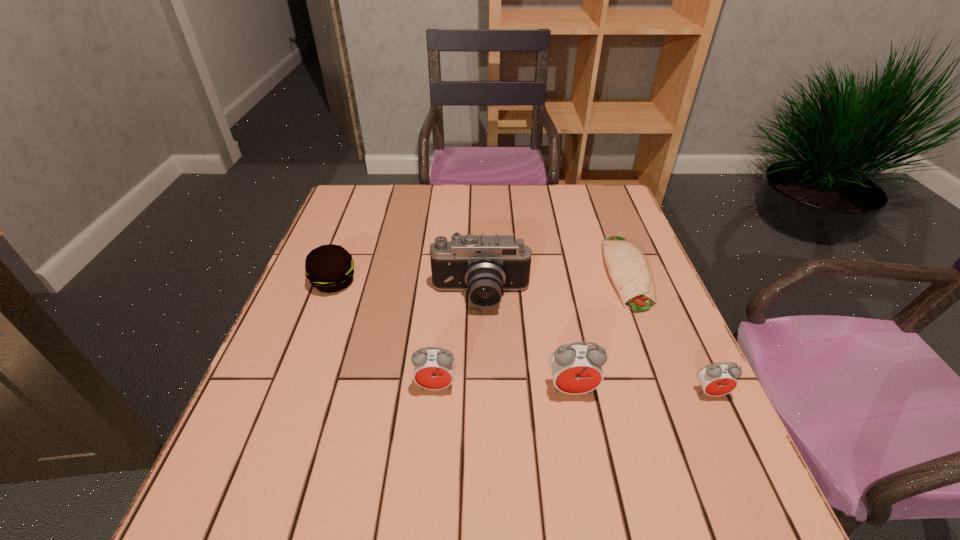
This screenshot has height=540, width=960. I want to click on free space for a new alarm clock on the left, so click(301, 383).